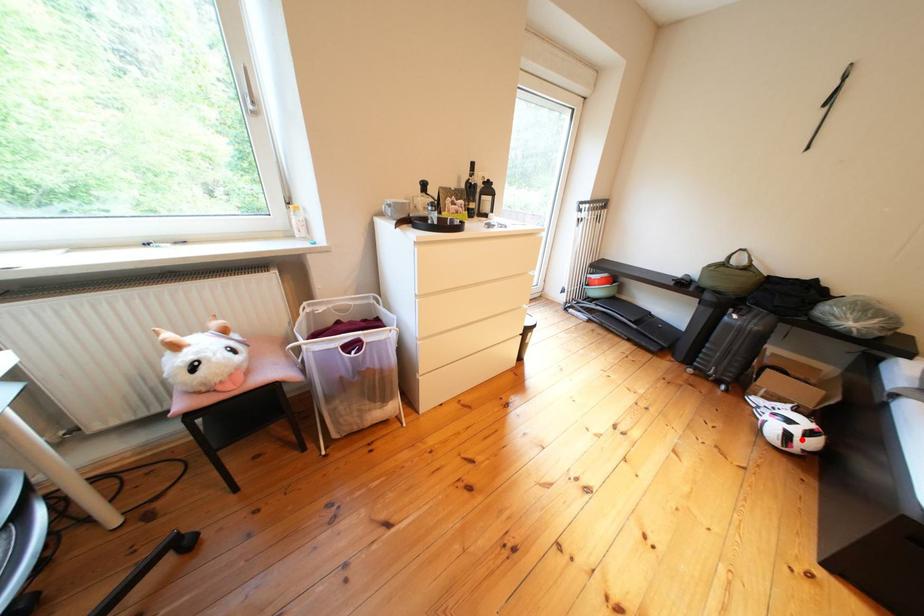
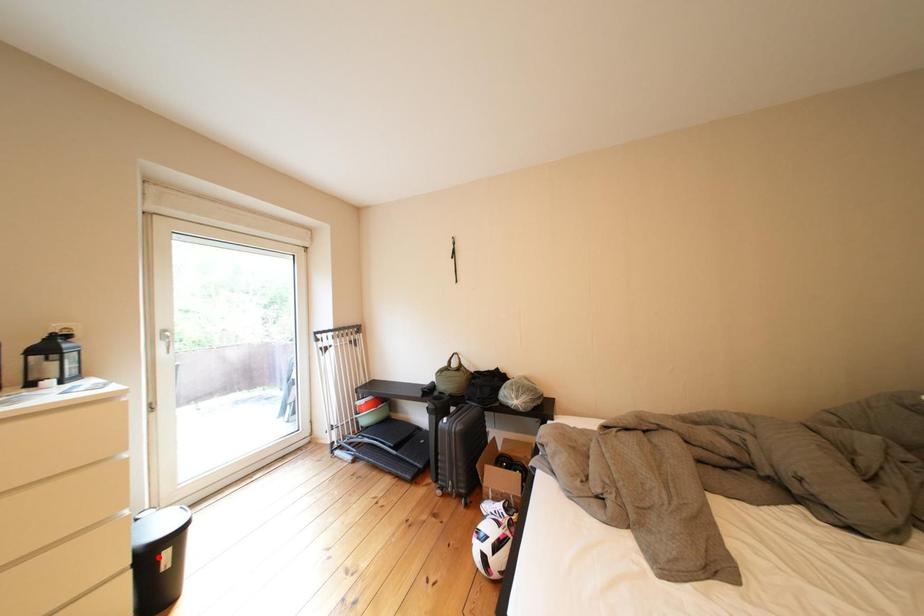
I am providing you with two images of the same scene from different viewpoints. A red point is marked on the first image and another point is marked on the second image. Is the marked point in image1 the same physical position as the marked point in image2?

No